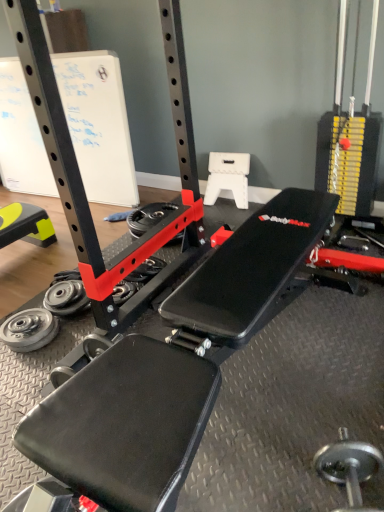
Find the location of `vacant space to the right of silver metallic weight plate at lower left, which appears as the 1th wheel when viewed from the front`. vacant space to the right of silver metallic weight plate at lower left, which appears as the 1th wheel when viewed from the front is located at coordinates (68, 335).